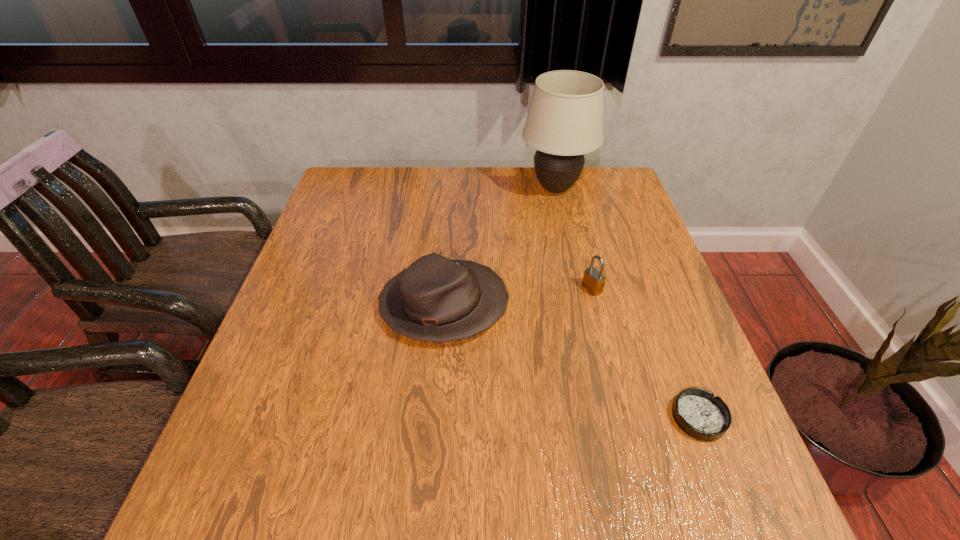
The image size is (960, 540). Identify the location of object that stands as the second closest to the hat. (565, 118).

Where is `vacant point that satisfies the following two spatial constraints: 1. on the front side of the padlock; 2. on the left side of the farthest object`? vacant point that satisfies the following two spatial constraints: 1. on the front side of the padlock; 2. on the left side of the farthest object is located at coordinates [x=578, y=288].

Find the location of a particular element. The width and height of the screenshot is (960, 540). free point that satisfies the following two spatial constraints: 1. on the front side of the rightmost object; 2. on the left side of the lampshade is located at coordinates (607, 417).

At what (x,y) coordinates should I click in order to perform the action: click on free point that satisfies the following two spatial constraints: 1. on the back side of the shortest object; 2. on the decorative side of the hat. Please return your answer as a coordinate pair (x, y). Looking at the image, I should click on (656, 306).

The height and width of the screenshot is (540, 960). I want to click on blank area in the image that satisfies the following two spatial constraints: 1. on the front side of the padlock; 2. on the left side of the ashtray, so click(x=625, y=417).